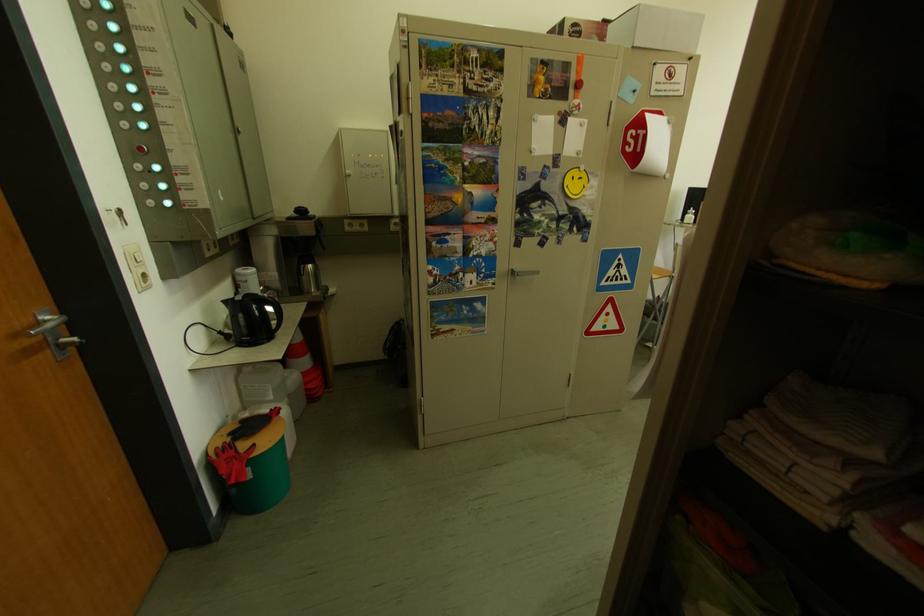
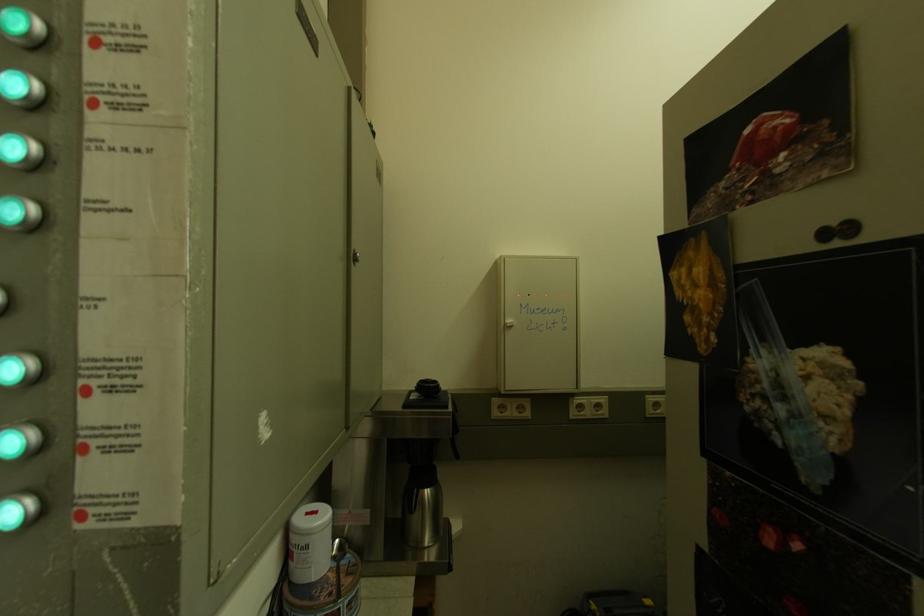
Locate, in the second image, the point that corresponds to point 362,179 in the first image.

(524, 330)